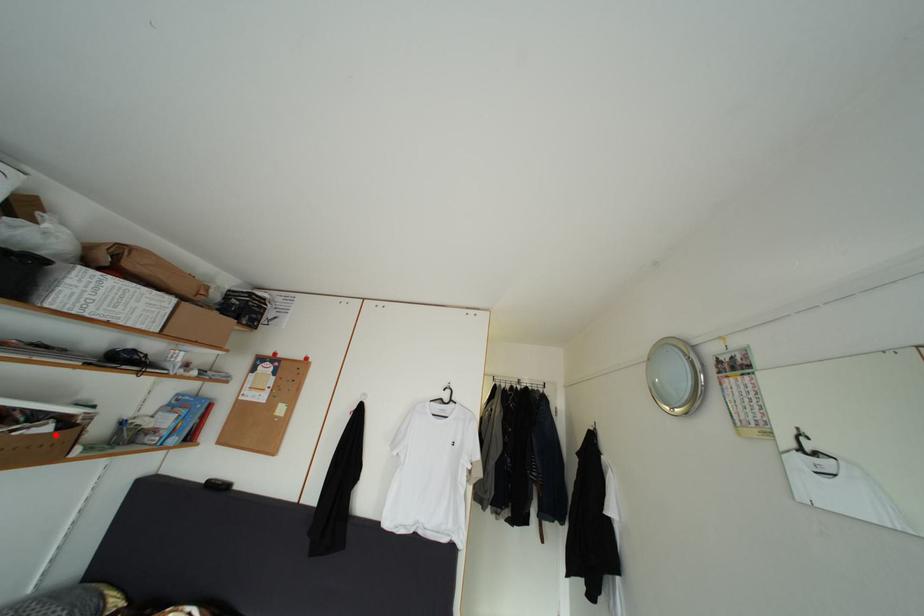
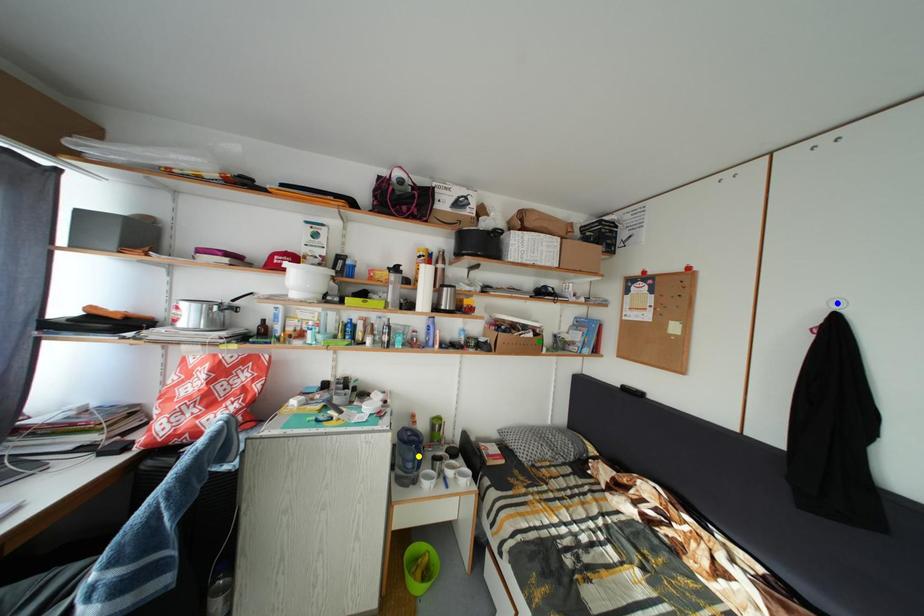
Question: I am providing you with two images of the same scene from different viewpoints. A red point is marked on the first image. You are given multiple points on the second image. Which point in image 2 is actually the same real-world point as the red point in image 1?

Choices:
 (A) green point
 (B) blue point
 (C) yellow point

Answer: (A)